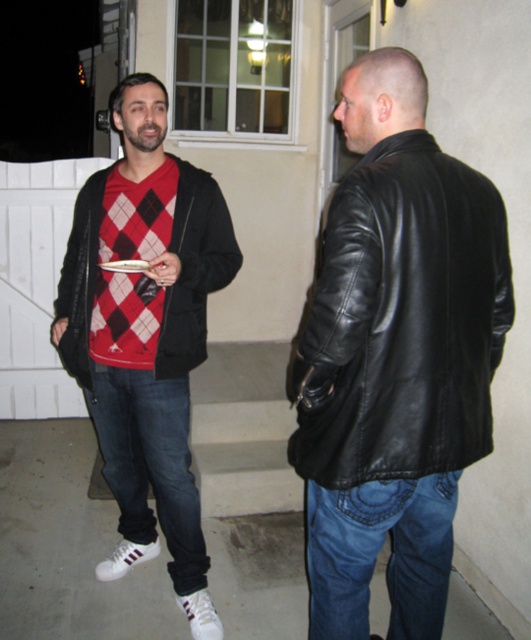
Question: Is denim jeans at lower right wider than matte black jacket at left?

Choices:
 (A) yes
 (B) no

Answer: (B)

Question: Which point is farther to the camera?

Choices:
 (A) matte black hoodie at left
 (B) dark blue denim jeans at lower left

Answer: (B)

Question: Which of these objects is positioned closest to the black leather jacket at right?

Choices:
 (A) denim jeans at lower right
 (B) dark blue denim jeans at lower left
 (C) matte black jacket at left
 (D) matte black hoodie at left

Answer: (A)

Question: Which point is farther from the camera taking this photo?

Choices:
 (A) (438, 340)
 (B) (409, 545)
 (C) (78, 241)
 (D) (90, 365)

Answer: (C)

Question: Is matte black hoodie at left positioned before denim jeans at lower right?

Choices:
 (A) no
 (B) yes

Answer: (A)

Question: In this image, where is matte black hoodie at left located relative to dark blue denim jeans at lower left?

Choices:
 (A) right
 (B) left

Answer: (B)